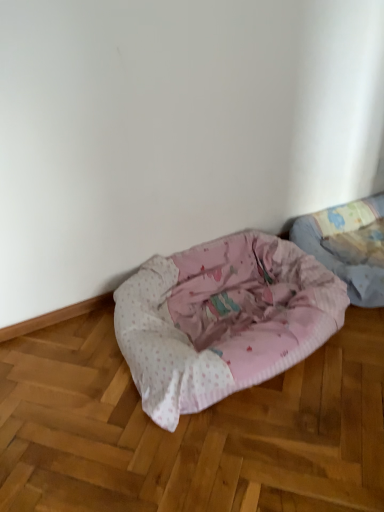
Question: In which direction should I rotate to look at pink fabric dog bed at lower center, the 1th dog bed positioned from the left?

Choices:
 (A) left
 (B) right

Answer: (B)

Question: Does pink fabric dog bed at lower center, the second dog bed viewed from the right, turn towards pink fabric dog bed at lower right, the 1th dog bed in the right-to-left sequence?

Choices:
 (A) yes
 (B) no

Answer: (B)

Question: Is pink fabric dog bed at lower center, the second dog bed viewed from the right, at the right side of pink fabric dog bed at lower right, the 2th dog bed positioned from the left?

Choices:
 (A) yes
 (B) no

Answer: (B)

Question: Does pink fabric dog bed at lower center, the second dog bed viewed from the right, have a lesser width compared to pink fabric dog bed at lower right, the 1th dog bed in the right-to-left sequence?

Choices:
 (A) yes
 (B) no

Answer: (B)

Question: From a real-world perspective, is pink fabric dog bed at lower center, the 1th dog bed positioned from the left, on top of pink fabric dog bed at lower right, the 1th dog bed in the right-to-left sequence?

Choices:
 (A) no
 (B) yes

Answer: (B)

Question: Can you confirm if pink fabric dog bed at lower center, the 1th dog bed positioned from the left, is smaller than pink fabric dog bed at lower right, the 2th dog bed positioned from the left?

Choices:
 (A) yes
 (B) no

Answer: (B)

Question: Does pink fabric dog bed at lower center, the 1th dog bed positioned from the left, come behind pink fabric dog bed at lower right, the 1th dog bed in the right-to-left sequence?

Choices:
 (A) yes
 (B) no

Answer: (B)

Question: Does pink fabric dog bed at lower right, the 1th dog bed in the right-to-left sequence, have a lesser height compared to pink fabric dog bed at lower center, the 1th dog bed positioned from the left?

Choices:
 (A) no
 (B) yes

Answer: (B)

Question: Considering the relative positions of pink fabric dog bed at lower right, the 2th dog bed positioned from the left, and pink fabric dog bed at lower center, the 1th dog bed positioned from the left, in the image provided, is pink fabric dog bed at lower right, the 2th dog bed positioned from the left, to the right of pink fabric dog bed at lower center, the 1th dog bed positioned from the left, from the viewer's perspective?

Choices:
 (A) yes
 (B) no

Answer: (A)

Question: Is pink fabric dog bed at lower right, the 1th dog bed in the right-to-left sequence, positioned beyond the bounds of pink fabric dog bed at lower center, the 1th dog bed positioned from the left?

Choices:
 (A) yes
 (B) no

Answer: (A)

Question: Is the position of pink fabric dog bed at lower right, the 2th dog bed positioned from the left, more distant than that of pink fabric dog bed at lower center, the second dog bed viewed from the right?

Choices:
 (A) no
 (B) yes

Answer: (B)

Question: From a real-world perspective, is pink fabric dog bed at lower right, the 2th dog bed positioned from the left, located beneath pink fabric dog bed at lower center, the 1th dog bed positioned from the left?

Choices:
 (A) yes
 (B) no

Answer: (A)

Question: Is pink fabric dog bed at lower right, the 1th dog bed in the right-to-left sequence, next to pink fabric dog bed at lower center, the second dog bed viewed from the right?

Choices:
 (A) no
 (B) yes

Answer: (A)

Question: Is pink fabric dog bed at lower right, the 1th dog bed in the right-to-left sequence, in front of or behind pink fabric dog bed at lower center, the 1th dog bed positioned from the left, in the image?

Choices:
 (A) behind
 (B) front

Answer: (A)